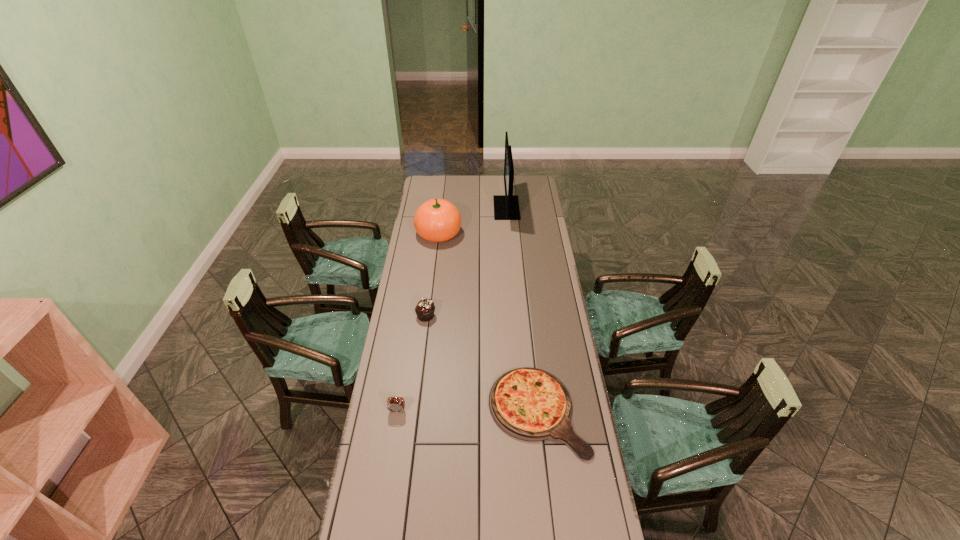
The width and height of the screenshot is (960, 540). Identify the location of vacant space at the left edge of the desktop. (412, 469).

This screenshot has width=960, height=540. What are the coordinates of `vacant space at the right edge of the desktop` in the screenshot? It's located at (540, 223).

You are a GUI agent. You are given a task and a screenshot of the screen. Output one action in this format:
    pyautogui.click(x=<x>, y=<y>)
    Task: Click on the vacant region between the shortest object and the cupcake
    The image size is (960, 540).
    Given the screenshot: What is the action you would take?
    pyautogui.click(x=482, y=363)

Where is `empty location between the alarm clock and the monitor`? empty location between the alarm clock and the monitor is located at coordinates (452, 309).

The height and width of the screenshot is (540, 960). I want to click on free spot between the pizza and the cupcake, so [x=482, y=363].

Where is `vacant region between the pumpkin and the shortest object`? This screenshot has height=540, width=960. vacant region between the pumpkin and the shortest object is located at coordinates (488, 322).

Locate an element on the screen. free space between the shortest object and the pumpkin is located at coordinates (488, 322).

Find the location of a particular element. The image size is (960, 540). empty space between the pizza and the tallest object is located at coordinates (522, 310).

Where is `free space between the pizza and the cupcake`? This screenshot has width=960, height=540. free space between the pizza and the cupcake is located at coordinates (482, 363).

Where is `vacant area between the pizza and the alarm clock`? vacant area between the pizza and the alarm clock is located at coordinates (468, 411).